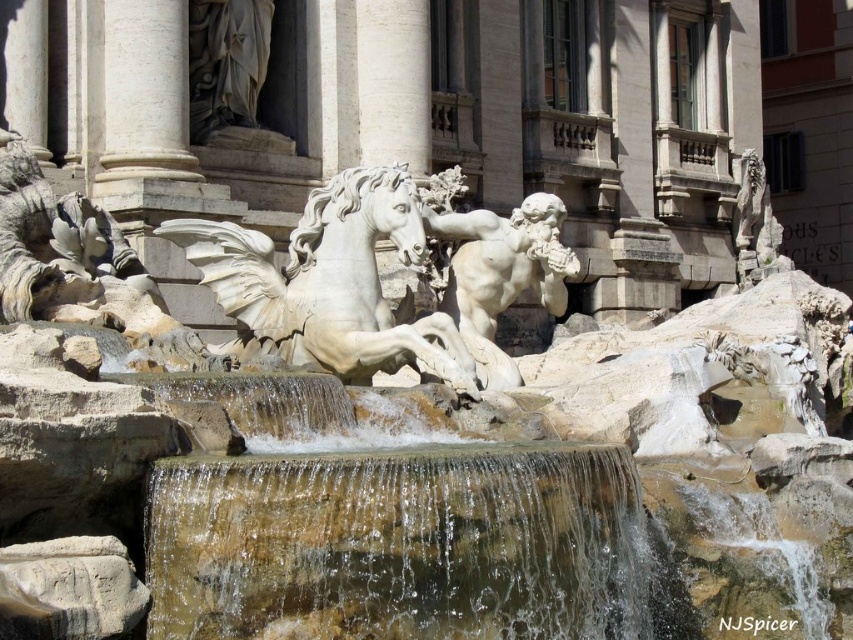
Question: Does translucent stone waterfall at center have a larger size compared to white marble horse at center?

Choices:
 (A) yes
 (B) no

Answer: (B)

Question: Which point appears closest to the camera in this image?

Choices:
 (A) (219, 636)
 (B) (148, 77)

Answer: (A)

Question: Does white marble horse at center appear on the right side of white marble statue at center?

Choices:
 (A) yes
 (B) no

Answer: (B)

Question: Which of the following is the farthest from the observer?

Choices:
 (A) white marble column at upper center
 (B) white marble statue at center
 (C) white marble horse at center
 (D) translucent stone waterfall at center

Answer: (A)

Question: Is the position of translucent stone waterfall at center less distant than that of white marble column at upper center?

Choices:
 (A) yes
 (B) no

Answer: (A)

Question: Estimate the real-world distances between objects in this image. Which object is closer to the white marble horse at center?

Choices:
 (A) translucent stone waterfall at center
 (B) white marble column at upper center
 (C) white marble statue at center

Answer: (C)